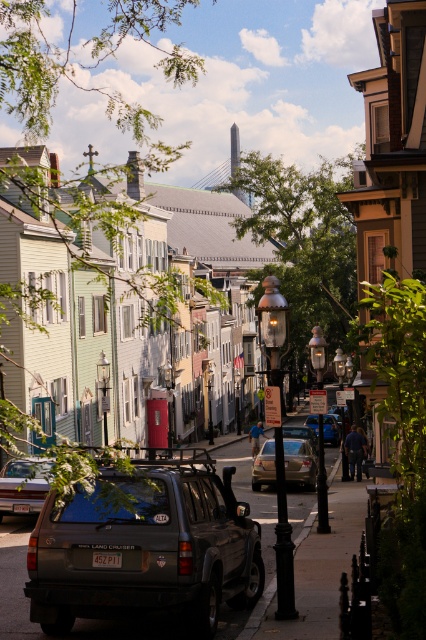
You are a delivery driver who needs to park your vehicle between the satin gold sedan at center and the metallic silver sedan at center. Your truck requires a minimum of 6 meters of space to maneuver safely. Based on the scene, can you safely park your truck between these two vehicles?

The satin gold sedan at center and metallic silver sedan at center are 5.60 meters apart from each other. Since the required space is 6 meters and the available space is only 5.60 meters, the truck cannot safely park between them.

You are a delivery driver who needs to park your vehicle between the matte gray suv at lower left and the satin gold sedan at center. Given that your delivery van is 5 meters long, can you fit it in the available space between them?

The matte gray suv at lower left is to the left of the satin gold sedan at center, but the exact distance between them isn not specified. Without knowing the space between the two vehicles, it is impossible to determine if the 5 meter long delivery van can fit there.